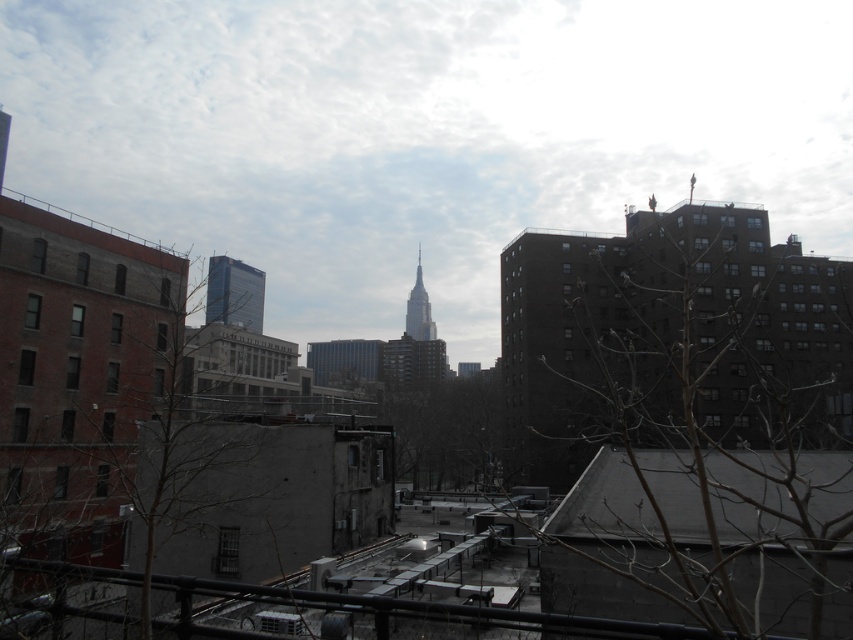
Question: Which point is closer to the camera?

Choices:
 (A) (235, 282)
 (B) (421, 326)

Answer: (A)

Question: Does smooth glass skyscraper at center appear on the right side of smooth glass spire at center?

Choices:
 (A) yes
 (B) no

Answer: (B)

Question: Which of the following is the farthest from the observer?

Choices:
 (A) (410, 298)
 (B) (254, 292)

Answer: (A)

Question: Is smooth glass skyscraper at center bigger than smooth glass spire at center?

Choices:
 (A) yes
 (B) no

Answer: (A)

Question: Can you confirm if smooth glass skyscraper at center is bigger than smooth glass spire at center?

Choices:
 (A) yes
 (B) no

Answer: (A)